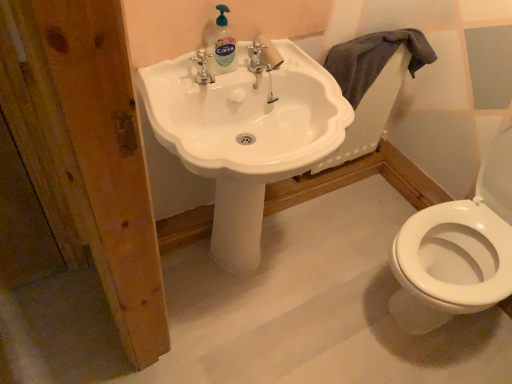
Where is `vacant space to the right of clear plastic bottle at upper center`? vacant space to the right of clear plastic bottle at upper center is located at coordinates (267, 77).